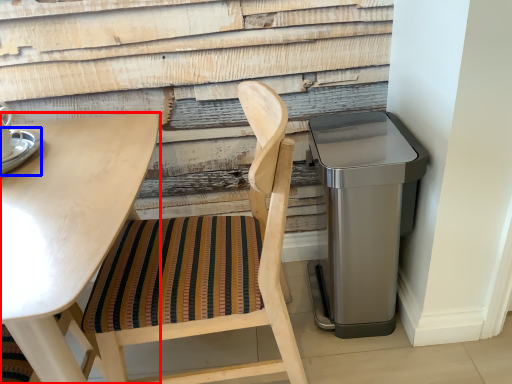
Question: Which point is closer to the camera, table (highlighted by a red box) or saucer (highlighted by a blue box)?

Choices:
 (A) table
 (B) saucer

Answer: (A)